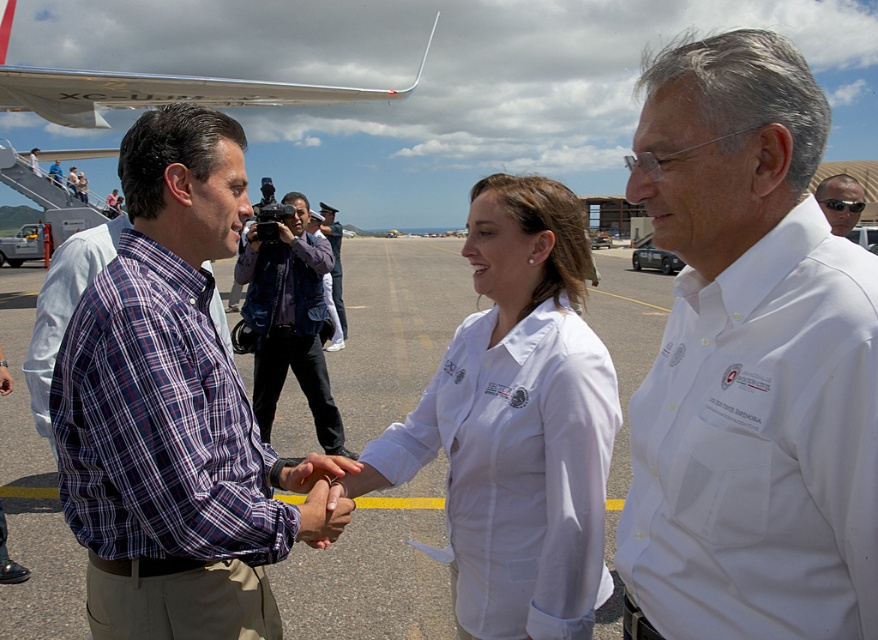
Question: Can you confirm if white shirt at center is positioned to the right of silver metallic airplane wing at upper left?

Choices:
 (A) yes
 (B) no

Answer: (A)

Question: Which point is farther to the camera?

Choices:
 (A) (11, 282)
 (B) (515, 524)
 (C) (322, 93)
 (D) (301, 323)

Answer: (A)

Question: Based on their relative distances, which object is nearer to the blue plaid shirt at center?

Choices:
 (A) silver metallic airplane wing at upper left
 (B) smooth asphalt tarmac at center
 (C) plaid cotton shirt at center

Answer: (C)

Question: Which point is closer to the camera?

Choices:
 (A) white shirt at center
 (B) plaid cotton shirt at center

Answer: (A)

Question: Does plaid cotton shirt at center have a smaller size compared to blue plaid shirt at center?

Choices:
 (A) yes
 (B) no

Answer: (B)

Question: Does white smooth shirt at center have a lesser width compared to silver metallic airplane wing at upper left?

Choices:
 (A) yes
 (B) no

Answer: (A)